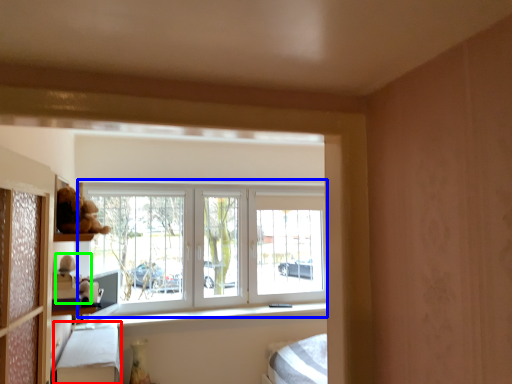
Question: Which is farther away from bed frame (highlighted by a red box)? window (highlighted by a blue box) or toy (highlighted by a green box)?

Choices:
 (A) window
 (B) toy

Answer: (A)